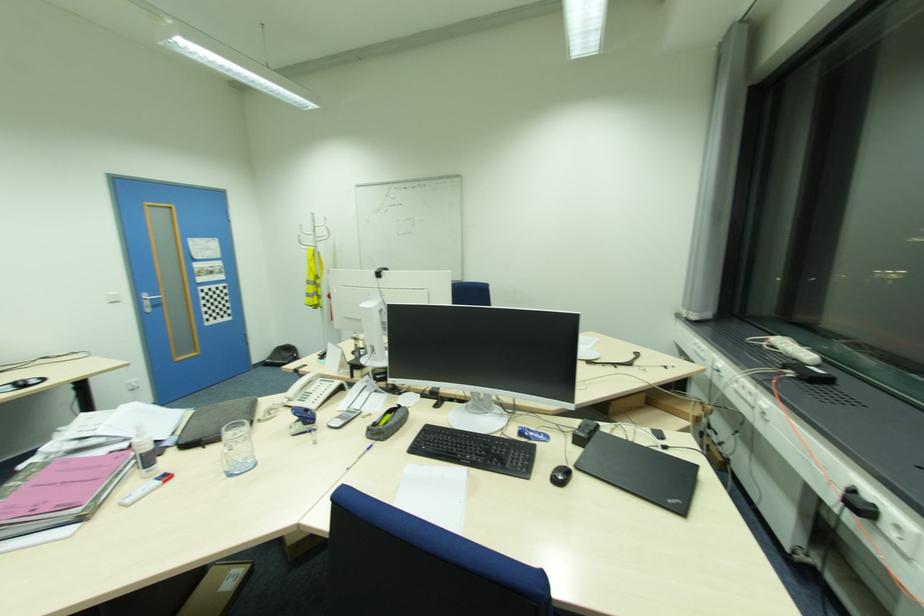
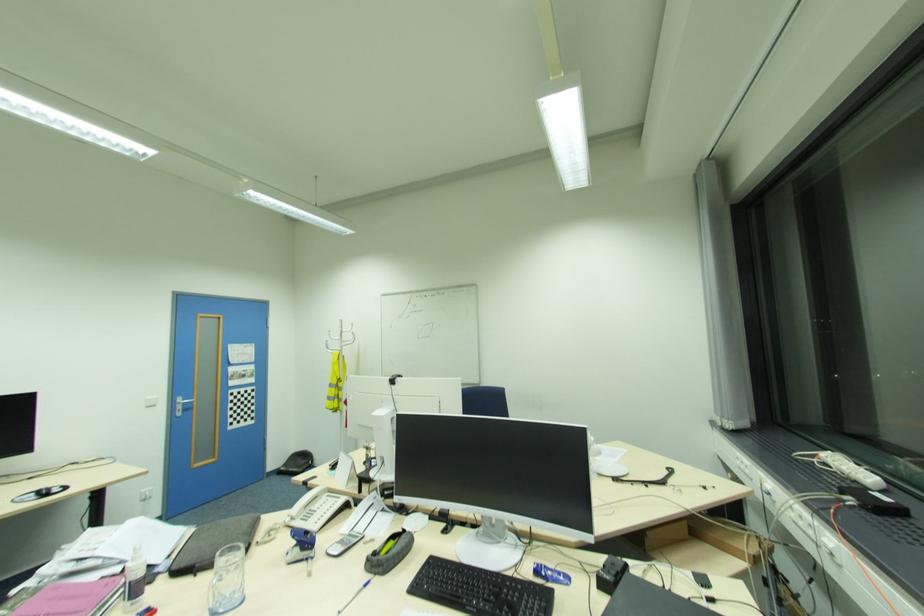
Question: I am providing you with two images of the same scene from different viewpoints. Please identify which objects are invisible in image2.

Choices:
 (A) black and silver pen
 (B) clear drinking glass
 (C) coat rack hook
 (D) none of these

Answer: (D)